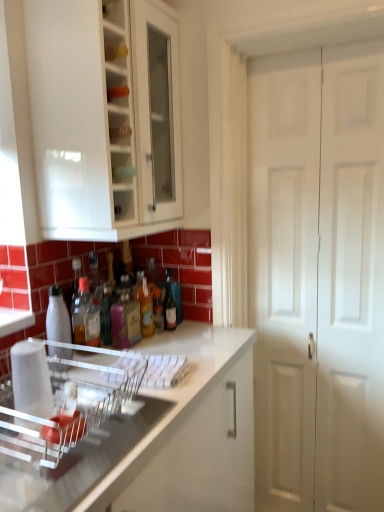
Question: From a real-world perspective, is white matte door at right located higher than matte glass bottle at center, which appears as the first bottle when viewed from the right?

Choices:
 (A) yes
 (B) no

Answer: (B)

Question: Could you tell me if white matte door at right is facing matte glass bottle at center, which appears as the first bottle when viewed from the right?

Choices:
 (A) yes
 (B) no

Answer: (B)

Question: Does white matte door at right come in front of matte glass bottle at center, the sixth bottle when ordered from left to right?

Choices:
 (A) yes
 (B) no

Answer: (A)

Question: From the image's perspective, does white matte door at right appear lower than matte glass bottle at center, which appears as the first bottle when viewed from the right?

Choices:
 (A) yes
 (B) no

Answer: (A)

Question: Would you say matte glass bottle at center, which appears as the first bottle when viewed from the right, is part of white matte door at right's contents?

Choices:
 (A) yes
 (B) no

Answer: (B)

Question: From the image's perspective, is white matte door at right on matte glass bottle at center, which appears as the first bottle when viewed from the right?

Choices:
 (A) no
 (B) yes

Answer: (A)

Question: Does translucent plastic bottle at center, the second bottle in the left-to-right sequence, have a greater height compared to clear plastic dish rack at center?

Choices:
 (A) yes
 (B) no

Answer: (A)

Question: Considering the relative sizes of translucent plastic bottle at center, the second bottle in the left-to-right sequence, and clear plastic dish rack at center in the image provided, is translucent plastic bottle at center, the second bottle in the left-to-right sequence, bigger than clear plastic dish rack at center?

Choices:
 (A) yes
 (B) no

Answer: (B)

Question: Does translucent plastic bottle at center, the fifth bottle in the right-to-left sequence, come in front of clear plastic dish rack at center?

Choices:
 (A) yes
 (B) no

Answer: (B)

Question: Can you confirm if translucent plastic bottle at center, the fifth bottle in the right-to-left sequence, is shorter than clear plastic dish rack at center?

Choices:
 (A) no
 (B) yes

Answer: (A)

Question: Would you say clear plastic dish rack at center is part of translucent plastic bottle at center, the fifth bottle in the right-to-left sequence,'s contents?

Choices:
 (A) yes
 (B) no

Answer: (B)

Question: Can you confirm if translucent plastic bottle at center, the second bottle in the left-to-right sequence, is wider than clear plastic dish rack at center?

Choices:
 (A) yes
 (B) no

Answer: (B)

Question: Is pink matte bottle at center, marked as the 4th bottle in a right-to-left arrangement, directly adjacent to clear plastic dish rack at center?

Choices:
 (A) yes
 (B) no

Answer: (B)